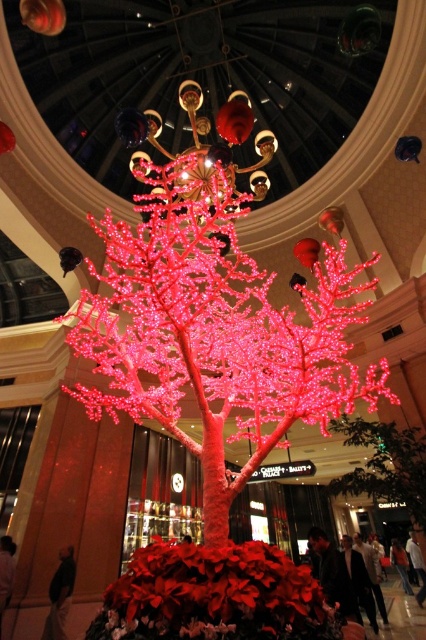
How far apart are illuminated plastic tree at center and gold metallic chandelier at upper center?

6.70 meters

Between illuminated plastic tree at center and gold metallic chandelier at upper center, which one is positioned higher?

gold metallic chandelier at upper center is higher up.

At what (x,y) coordinates should I click in order to perform the action: click on illuminated plastic tree at center. Please return your answer as a coordinate pair (x, y). Image resolution: width=426 pixels, height=640 pixels. Looking at the image, I should click on (215, 332).